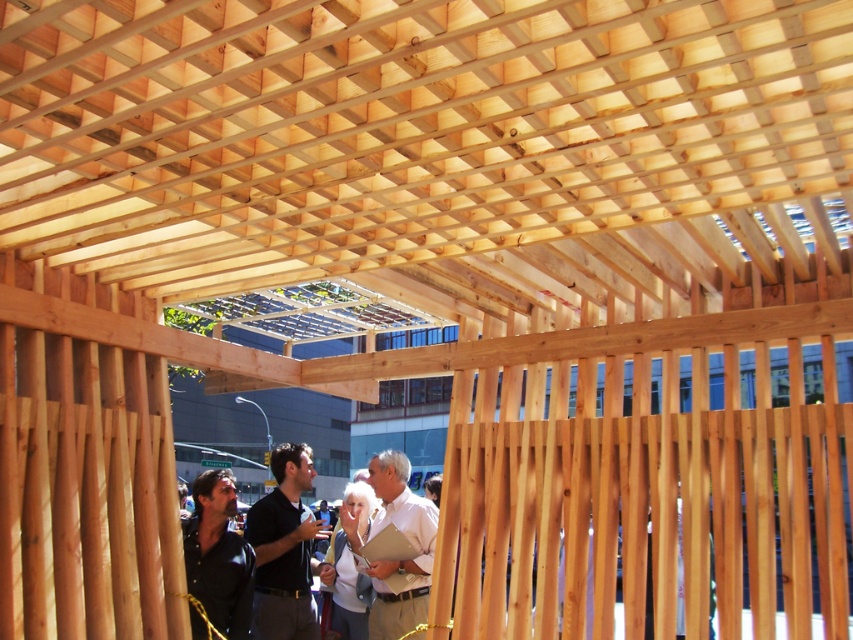
You are an architect designing a new pavilion and are looking at the partially constructed wooden structure. You notice two people wearing a black shirt at center and a white matte shirt at center. Which person is taking up more space in the scene?

The white matte shirt at center is taking up more space in the scene because it occupies more space than the black shirt at center.

You are an architect inspecting the construction site. You notice two clothing items in the scene. Which clothing item is taller between the white matte shirt at center and the dark brown leather jacket at lower left?

The white matte shirt at center is taller than the dark brown leather jacket at lower left according to the description.